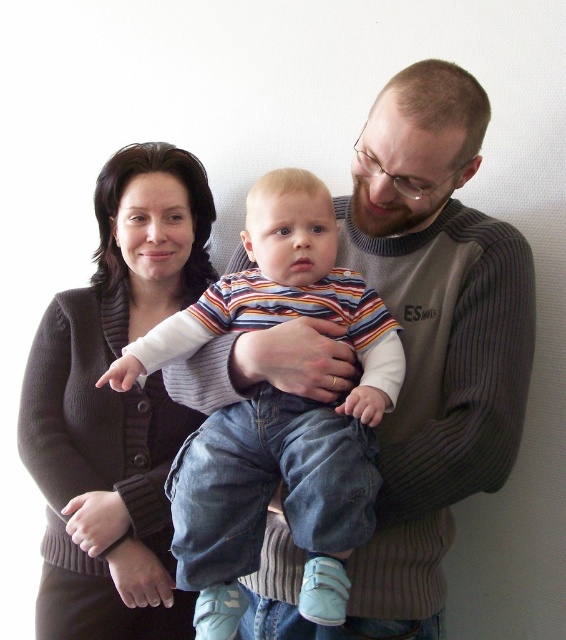
Question: Can you confirm if striped cotton shirt at center is positioned below dark brown sweater at center?

Choices:
 (A) yes
 (B) no

Answer: (B)

Question: Is striped cotton shirt at center bigger than dark brown sweater at center?

Choices:
 (A) no
 (B) yes

Answer: (A)

Question: Can you confirm if striped cotton shirt at center is positioned above dark brown sweater at center?

Choices:
 (A) no
 (B) yes

Answer: (B)